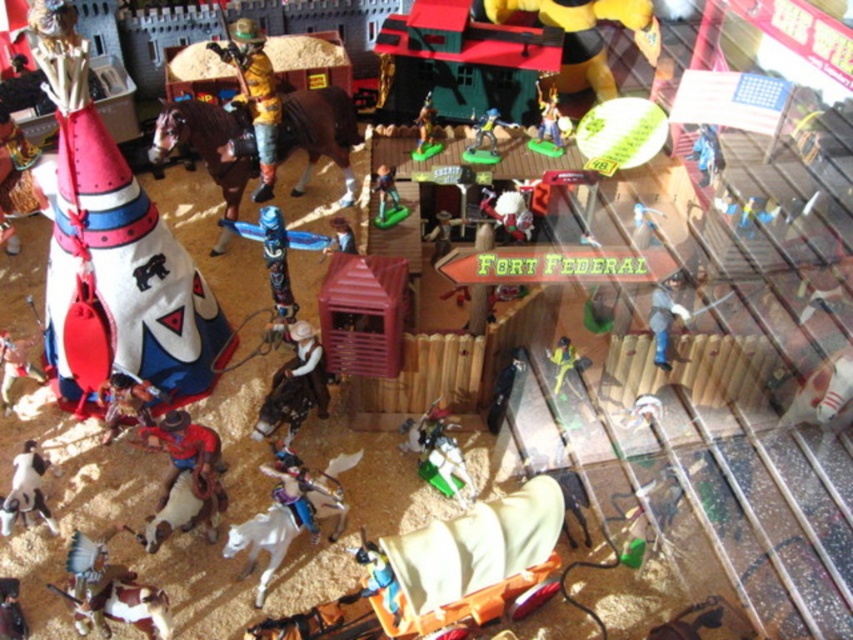
Question: Is white fur horse at lower center to the right of green plastic cowboy at center from the viewer's perspective?

Choices:
 (A) yes
 (B) no

Answer: (B)

Question: Which point is farther to the camera?

Choices:
 (A) green plastic horse at center
 (B) shiny yellow helmet at center
 (C) shiny yellow cowboy at center
 (D) white fabric teepee at left

Answer: (C)

Question: Which point is farther to the camera?

Choices:
 (A) beige fabric covered wagon at center
 (B) green plastic toy at lower right

Answer: (B)

Question: Based on their relative distances, which object is farther from the brown matte horse at upper left?

Choices:
 (A) metallic silver rifle at center
 (B) green plastic toy at lower right
 (C) matte plastic cowboy at center
 (D) yellow matte figure at upper center

Answer: (A)

Question: Is the position of yellow matte figure at upper center less distant than that of matte plastic cowboy at center?

Choices:
 (A) no
 (B) yes

Answer: (A)

Question: Considering the relative positions of brown matte horse at upper left and white fur horse at lower center in the image provided, where is brown matte horse at upper left located with respect to white fur horse at lower center?

Choices:
 (A) right
 (B) left

Answer: (B)